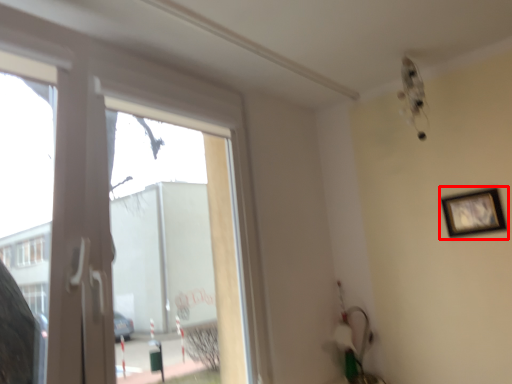
Question: In this image, where is picture frame (annotated by the red box) located relative to window?

Choices:
 (A) right
 (B) left

Answer: (A)